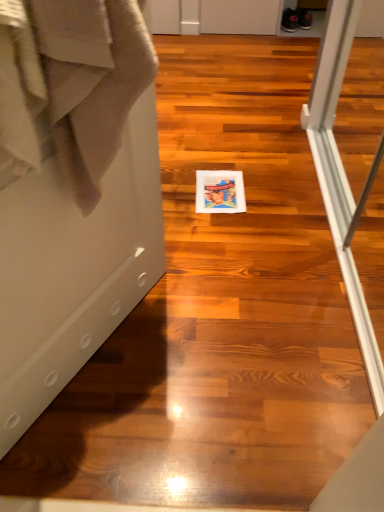
Question: Can you confirm if matte paper postcard at center is smaller than beige cotton bath towel at left?

Choices:
 (A) yes
 (B) no

Answer: (A)

Question: Considering the relative sizes of matte paper postcard at center and beige cotton bath towel at left in the image provided, is matte paper postcard at center thinner than beige cotton bath towel at left?

Choices:
 (A) yes
 (B) no

Answer: (B)

Question: Is matte paper postcard at center in contact with beige cotton bath towel at left?

Choices:
 (A) no
 (B) yes

Answer: (A)

Question: Is matte paper postcard at center shorter than beige cotton bath towel at left?

Choices:
 (A) yes
 (B) no

Answer: (A)

Question: Considering the relative sizes of matte paper postcard at center and beige cotton bath towel at left in the image provided, is matte paper postcard at center bigger than beige cotton bath towel at left?

Choices:
 (A) no
 (B) yes

Answer: (A)

Question: Can beige cotton bath towel at left be found inside matte paper postcard at center?

Choices:
 (A) no
 (B) yes

Answer: (A)

Question: Is beige cotton bath towel at left far from matte paper postcard at center?

Choices:
 (A) yes
 (B) no

Answer: (A)

Question: Is beige cotton bath towel at left further to the viewer compared to matte paper postcard at center?

Choices:
 (A) yes
 (B) no

Answer: (B)

Question: Is beige cotton bath towel at left closer to the viewer compared to matte paper postcard at center?

Choices:
 (A) yes
 (B) no

Answer: (A)

Question: Considering the relative sizes of beige cotton bath towel at left and matte paper postcard at center in the image provided, is beige cotton bath towel at left thinner than matte paper postcard at center?

Choices:
 (A) yes
 (B) no

Answer: (A)

Question: Considering the relative positions of beige cotton bath towel at left and matte paper postcard at center in the image provided, is beige cotton bath towel at left to the left of matte paper postcard at center from the viewer's perspective?

Choices:
 (A) yes
 (B) no

Answer: (A)

Question: Is beige cotton bath towel at left placed right next to matte paper postcard at center?

Choices:
 (A) yes
 (B) no

Answer: (B)

Question: Considering the relative sizes of white glossy screen door at center and matte paper postcard at center in the image provided, is white glossy screen door at center wider than matte paper postcard at center?

Choices:
 (A) no
 (B) yes

Answer: (A)